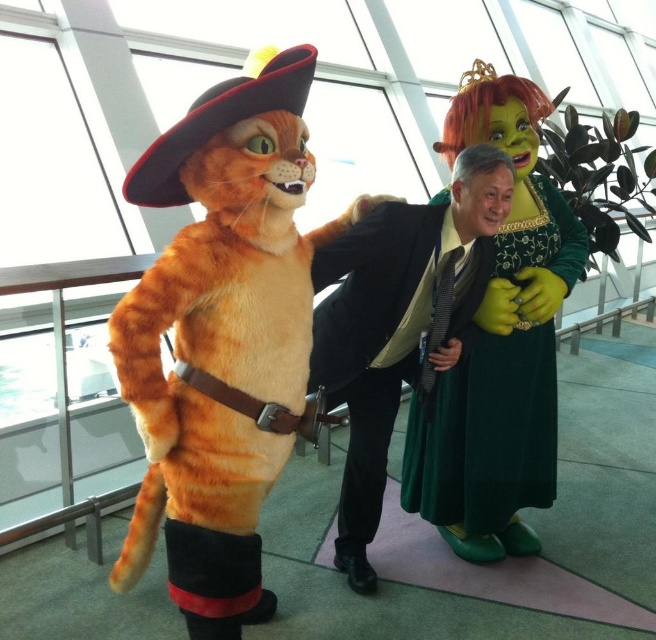
Who is positioned more to the left, fluffy orange cat at left or black suit at center?

fluffy orange cat at left

Is point (161, 451) less distant than point (480, 212)?

That is True.

Is point (211, 332) closer to viewer compared to point (422, 364)?

Yes, it is.

Where is `fluffy orange cat at left`? fluffy orange cat at left is located at coordinates (220, 332).

Locate an element on the screen. This screenshot has height=640, width=656. green velvet dress at center is located at coordinates (499, 346).

Measure the distance between green velvet dress at center and camera.

green velvet dress at center and camera are 2.08 meters apart.

At what (x,y) coordinates should I click in order to perform the action: click on green velvet dress at center. Please return your answer as a coordinate pair (x, y). The height and width of the screenshot is (640, 656). Looking at the image, I should click on (499, 346).

Who is positioned more to the right, fluffy orange cat at left or green velvet dress at center?

Positioned to the right is green velvet dress at center.

Image resolution: width=656 pixels, height=640 pixels. Describe the element at coordinates (220, 332) in the screenshot. I see `fluffy orange cat at left` at that location.

At what (x,y) coordinates should I click in order to perform the action: click on fluffy orange cat at left. Please return your answer as a coordinate pair (x, y). Image resolution: width=656 pixels, height=640 pixels. Looking at the image, I should click on (220, 332).

Identify the location of fluffy orange cat at left. (220, 332).